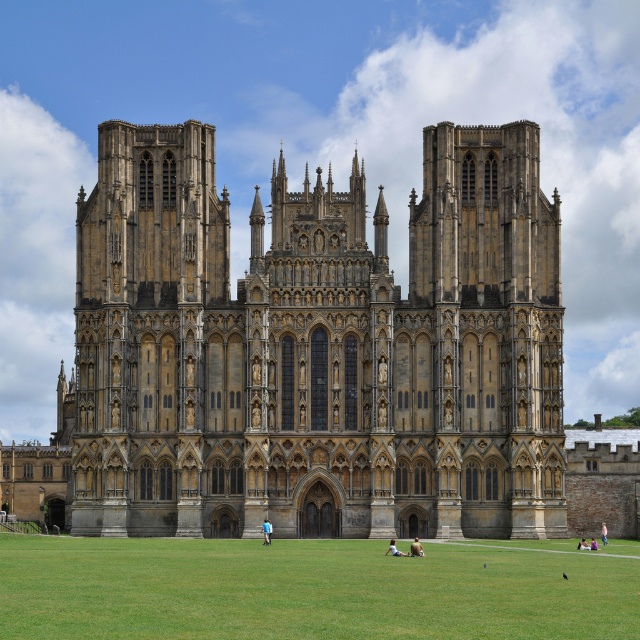
Can you confirm if yellow stone church at center is shorter than light brown leather jacket at lower center?

No, yellow stone church at center is not shorter than light brown leather jacket at lower center.

Does yellow stone church at center appear on the left side of light brown leather jacket at lower center?

Correct, you'll find yellow stone church at center to the left of light brown leather jacket at lower center.

Is point (413, 429) positioned before point (413, 548)?

That is False.

Find the location of a particular element. yellow stone church at center is located at coordinates (317, 348).

Who is lower down, green grass at lower center or blue fabric person at lower center?

green grass at lower center

Is green grass at lower center shorter than blue fabric person at lower center?

Correct, green grass at lower center is not as tall as blue fabric person at lower center.

Is point (26, 536) positioned after point (266, 540)?

That is True.

The width and height of the screenshot is (640, 640). Find the location of `green grass at lower center`. green grass at lower center is located at coordinates (314, 588).

Is pink fabric at center behind light brown leather bag at center?

That is True.

Is point (604, 529) positioned behind point (586, 545)?

Yes, it is behind point (586, 545).

This screenshot has width=640, height=640. In order to click on pink fabric at center in this screenshot , I will do `click(604, 532)`.